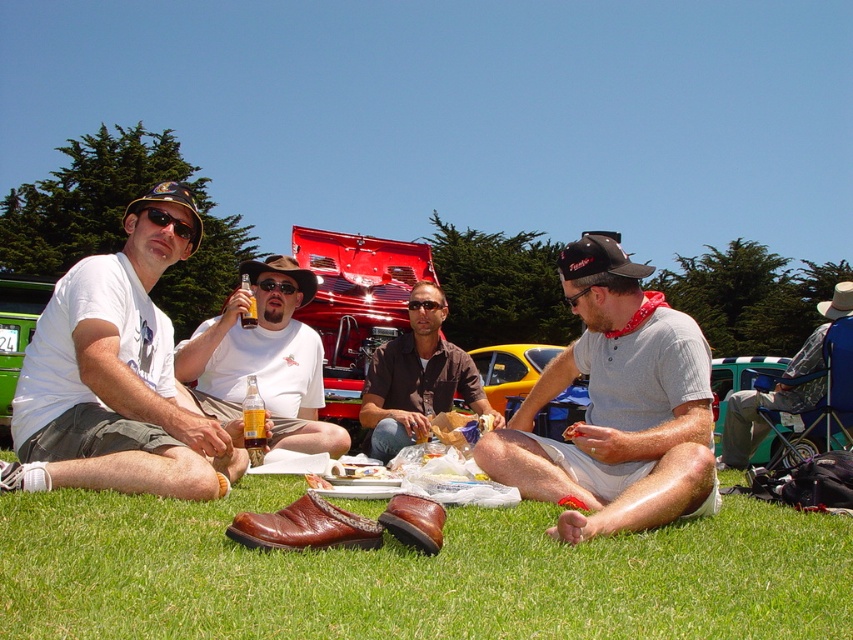
You are standing at the origin point in the image. Which direction should you move to reach the gray cotton shirt at center?

The gray cotton shirt at center is located at coordinates point (x=616, y=406). Since you are at the origin point, you should move towards the right and upward to reach it.

Please describe the color and material of the object located at the coordinates point (616, 406).

The object at point (616, 406) is a gray cotton shirt.